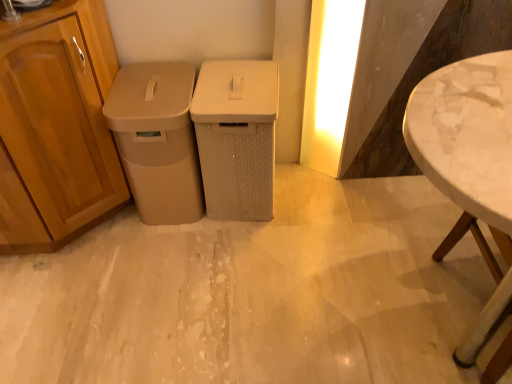
What are the coordinates of `vacant space that's between beige textured waste bin at center, positioned as the 1th waste container in right-to-left order, and yellow matte light at upper right` in the screenshot? It's located at (301, 184).